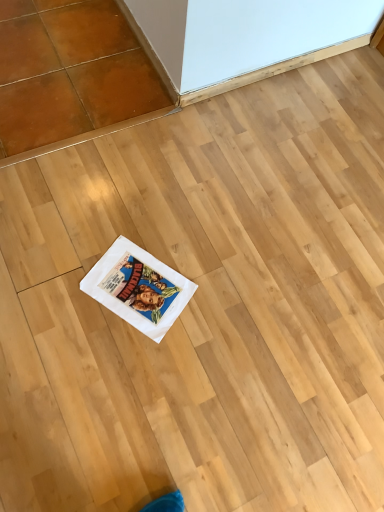
What are the coordinates of `free space behind white paper comic book at center` in the screenshot? It's located at (163, 220).